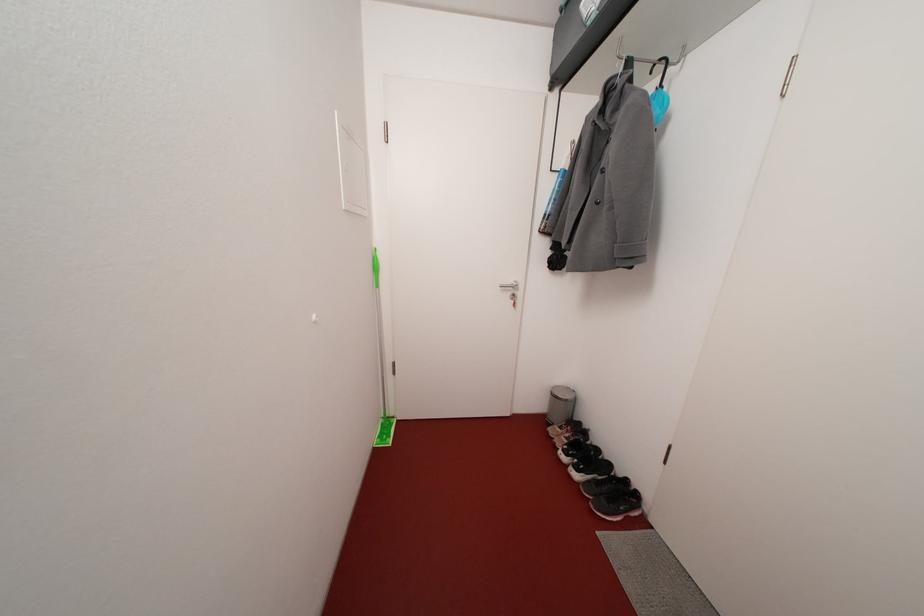
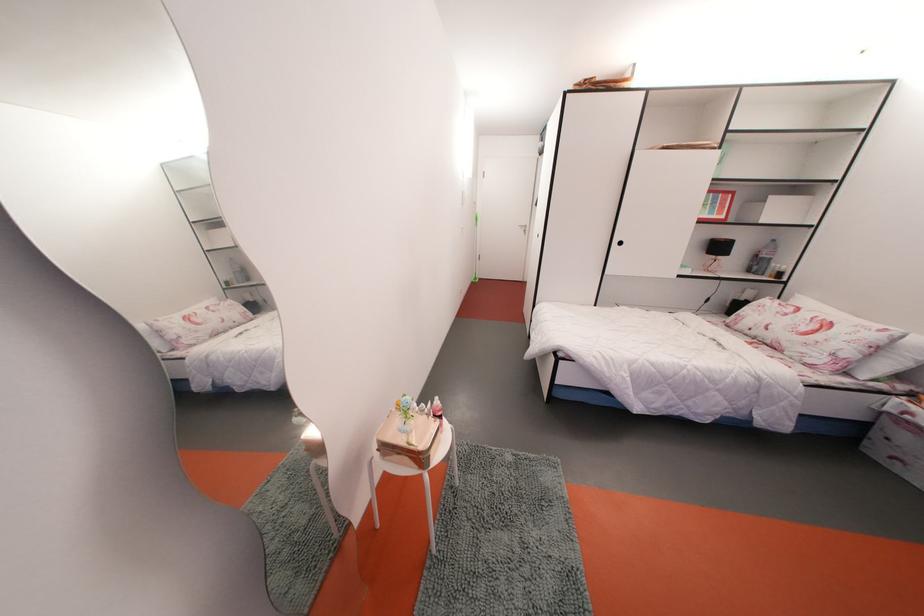
Question: What movement of the cameraman would produce the second image?

Choices:
 (A) Left
 (B) Right
 (C) Forward
 (D) Backward

Answer: (D)